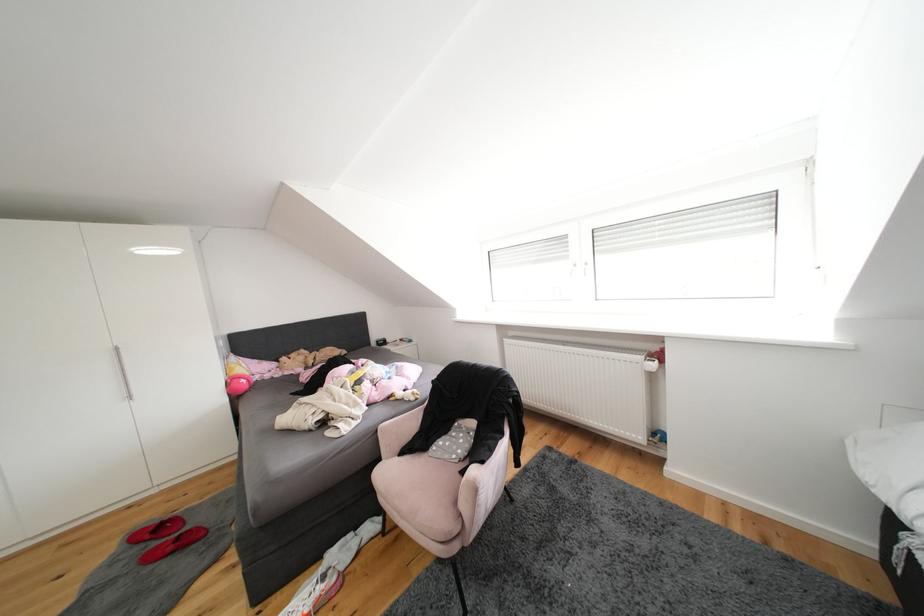
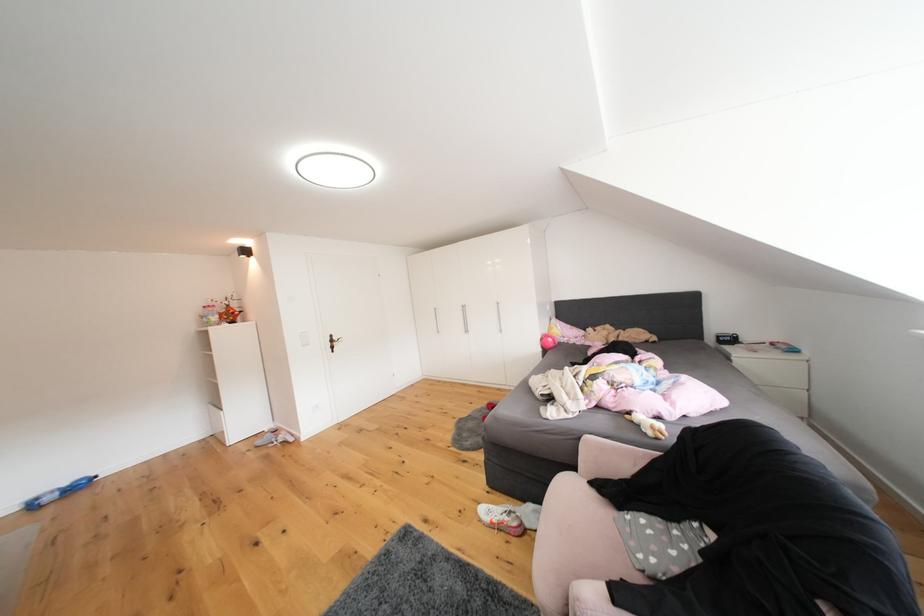
Question: The first image is from the beginning of the video and the second image is from the end. How did the camera likely rotate when shooting the video?

Choices:
 (A) Left
 (B) Right
 (C) Up
 (D) Down

Answer: (A)